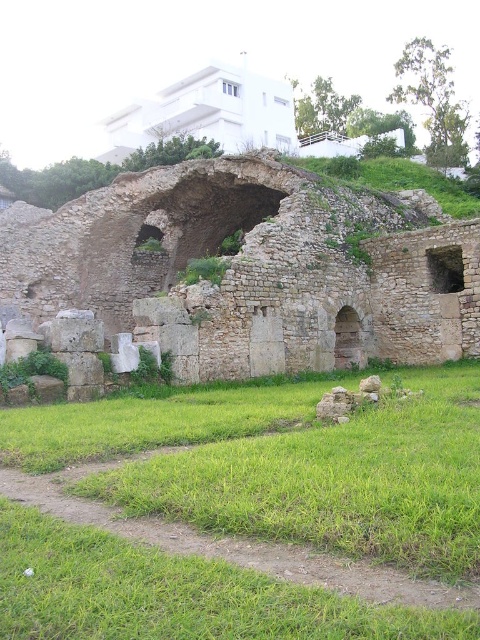
Question: Does green grass at center come behind stone archway at center?

Choices:
 (A) no
 (B) yes

Answer: (A)

Question: Which object appears farthest from the camera in this image?

Choices:
 (A) green grass at center
 (B) stone archway at center

Answer: (B)

Question: Considering the relative positions of green grass at center and stone archway at center in the image provided, where is green grass at center located with respect to stone archway at center?

Choices:
 (A) right
 (B) left

Answer: (A)

Question: Which point is closer to the camera?

Choices:
 (A) (139, 564)
 (B) (312, 256)

Answer: (A)

Question: Does green grass at center appear on the right side of stone archway at center?

Choices:
 (A) no
 (B) yes

Answer: (B)

Question: Which point is farther from the camera taking this photo?

Choices:
 (A) (80, 289)
 (B) (177, 444)

Answer: (A)